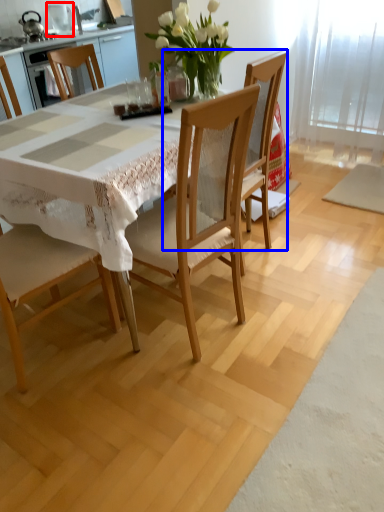
Question: Which of the following is the farthest to the observer, appliance (highlighted by a red box) or chair (highlighted by a blue box)?

Choices:
 (A) appliance
 (B) chair

Answer: (A)